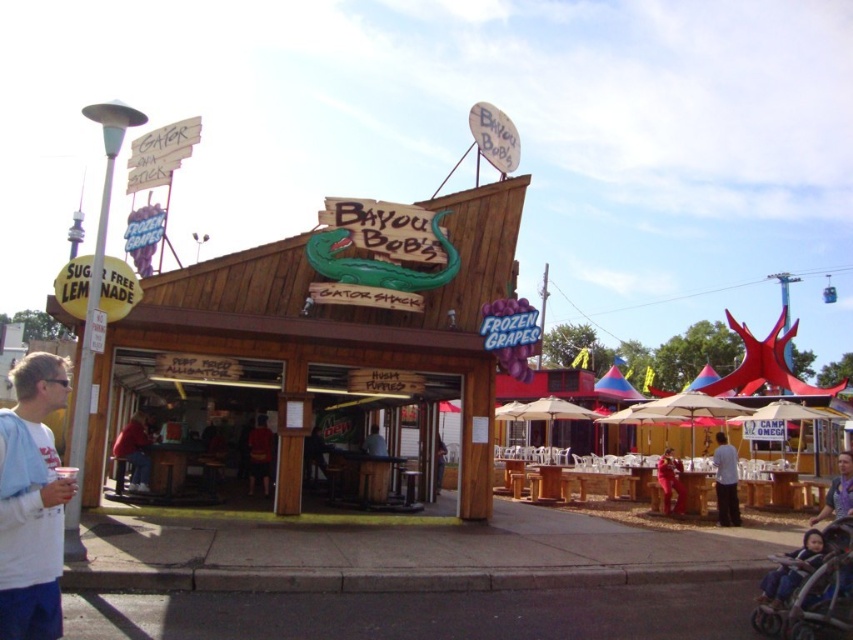
At what (x,y) coordinates should I click in order to perform the action: click on dark blue fabric stroller at lower right. Please return your answer as a coordinate pair (x, y). Looking at the image, I should click on coord(790,572).

Looking at this image, who is more forward, [798,561] or [850,492]?

Positioned in front is point [798,561].

Between point (821, 563) and point (822, 512), which one is positioned in front?

Point (821, 563) is in front.

Find the location of `dark blue fabric stroller at lower right`. dark blue fabric stroller at lower right is located at coordinates (790, 572).

Between point (41, 401) and point (770, 579), which one is positioned behind?

The point (770, 579) is more distant.

Does white hoodie at left have a lesser height compared to dark blue fabric stroller at lower right?

Yes, white hoodie at left is shorter than dark blue fabric stroller at lower right.

The image size is (853, 640). I want to click on white hoodie at left, so click(x=32, y=502).

This screenshot has width=853, height=640. What do you see at coordinates (259, 452) in the screenshot?
I see `red fabric shirt at center` at bounding box center [259, 452].

Does red fabric shirt at center appear under wooden table at center?

Yes, red fabric shirt at center is below wooden table at center.

Is point (270, 451) closer to viewer compared to point (373, 449)?

Yes.

You are a GUI agent. You are given a task and a screenshot of the screen. Output one action in this format:
    pyautogui.click(x=<x>, y=<y>)
    Task: Click on the red fabric shirt at center
    
    Given the screenshot: What is the action you would take?
    [x=259, y=452]